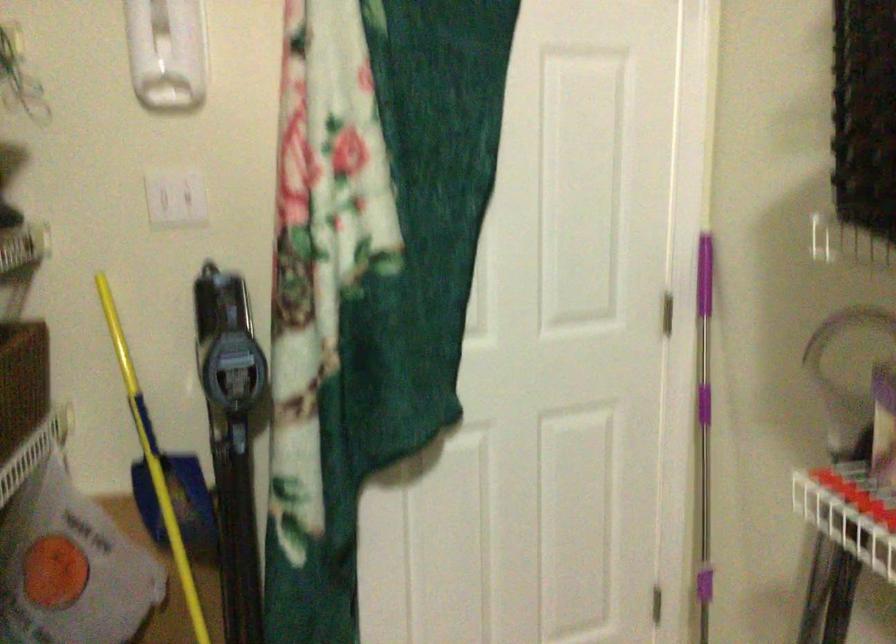
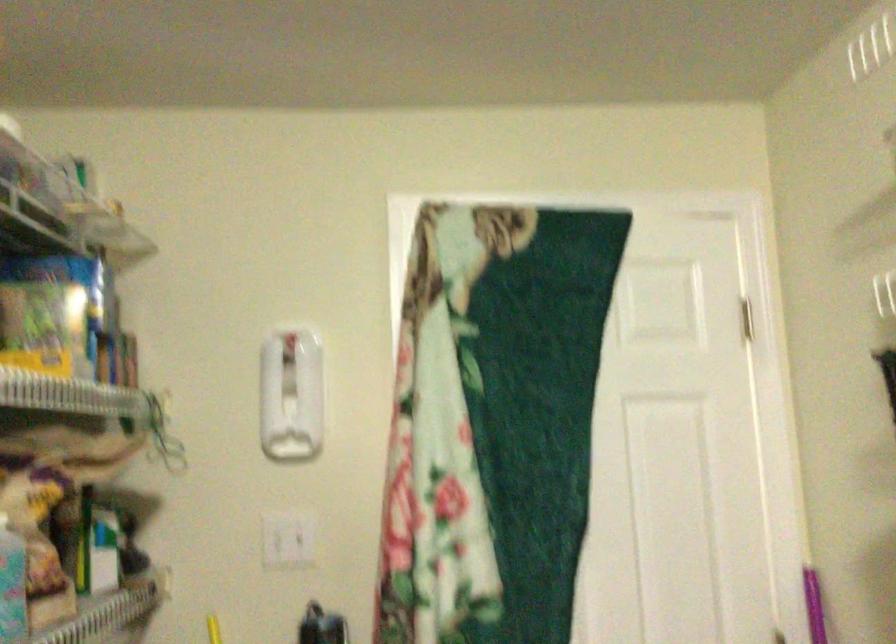
Question: What movement of the cameraman would produce the second image?

Choices:
 (A) Left
 (B) Right
 (C) Forward
 (D) Backward

Answer: (D)